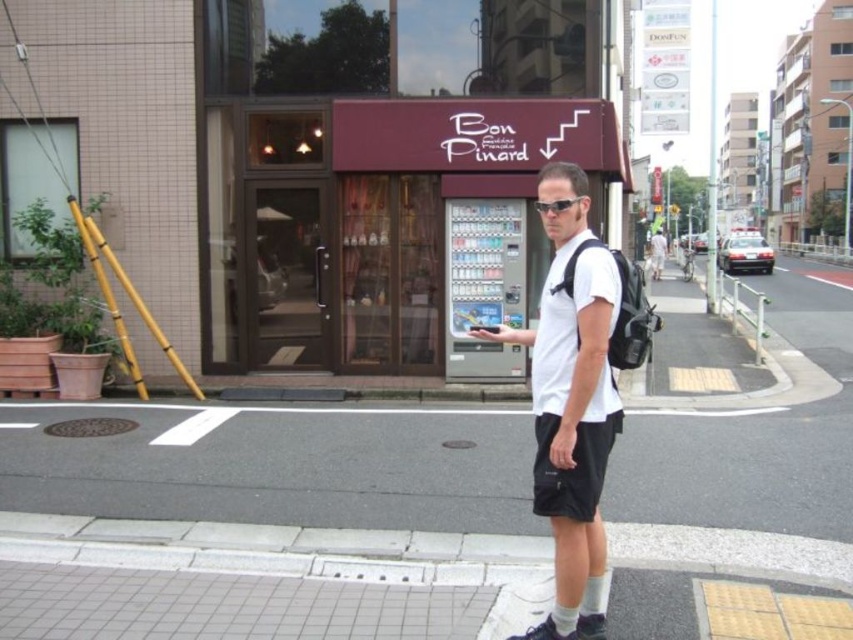
Looking at this image, you are a fashion designer analyzing the urban street scene. You notice the white matte shorts at center and the sunglasses at center. Which item appears larger in the image?

The white matte shorts at center appears larger than the sunglasses at center in the image.